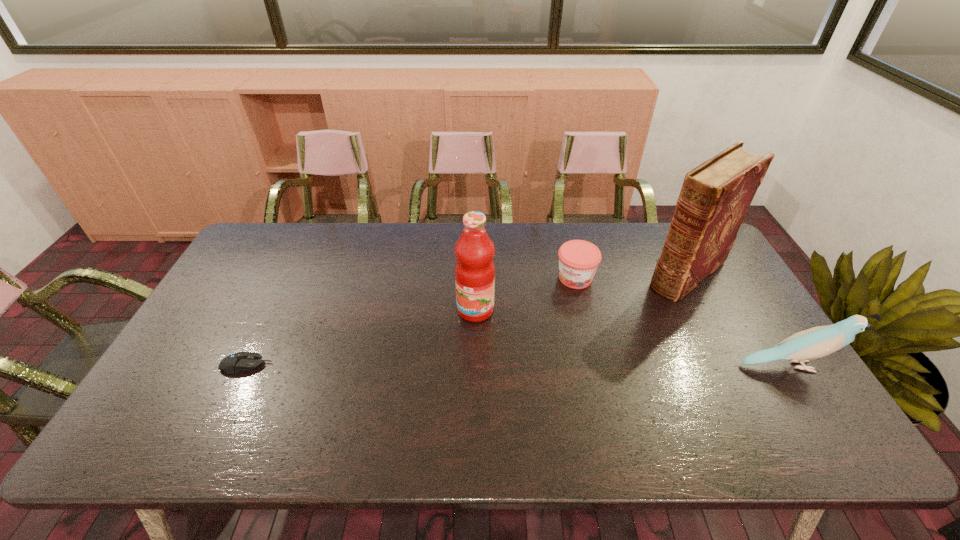
Where is `vacant space on the desktop that is between the leftmost object and the third tallest object and is positioned on the front label of the second shortest object`? This screenshot has height=540, width=960. vacant space on the desktop that is between the leftmost object and the third tallest object and is positioned on the front label of the second shortest object is located at coordinates (526, 366).

The width and height of the screenshot is (960, 540). What are the coordinates of `free space on the desktop that is between the leftmost object and the third tallest object and is positioned on the spine side of the hardback book` in the screenshot? It's located at (574, 366).

The image size is (960, 540). Find the location of `free spot on the desktop that is between the leftmost object and the third shortest object and is positioned on the front label of the fruit juice`. free spot on the desktop that is between the leftmost object and the third shortest object and is positioned on the front label of the fruit juice is located at coordinates (439, 366).